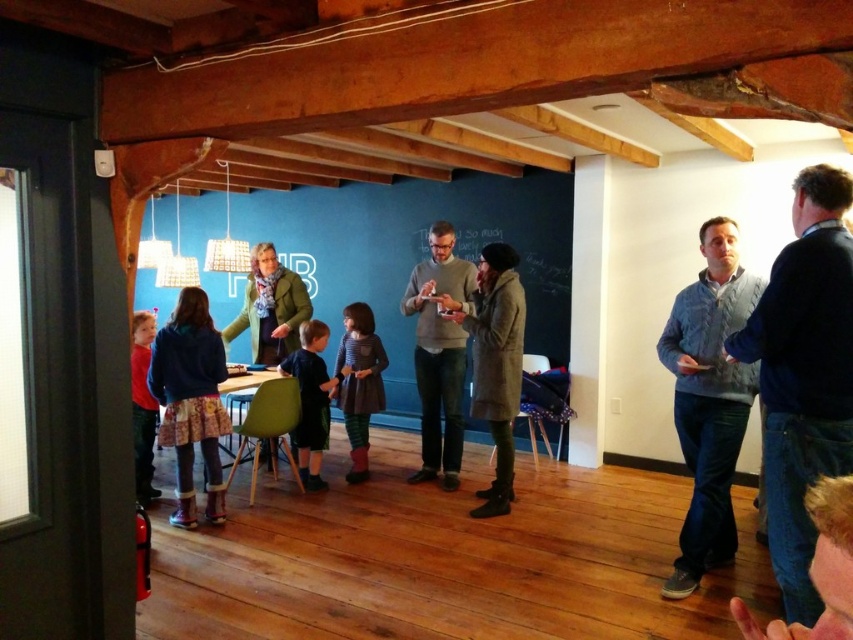
Is dark gray wool coat at center above dark blue shirt at center?

Yes.

Can you confirm if dark gray wool coat at center is smaller than dark blue shirt at center?

Incorrect, dark gray wool coat at center is not smaller in size than dark blue shirt at center.

Between point (486, 262) and point (305, 467), which one is positioned in front?

Point (486, 262) is more forward.

Identify the location of dark gray wool coat at center. (496, 364).

What do you see at coordinates (416, 252) in the screenshot? Image resolution: width=853 pixels, height=640 pixels. I see `matte black chalkboard at center` at bounding box center [416, 252].

Looking at this image, can you confirm if matte black chalkboard at center is bigger than dark blue shirt at center?

Correct, matte black chalkboard at center is larger in size than dark blue shirt at center.

This screenshot has height=640, width=853. What do you see at coordinates (416, 252) in the screenshot? I see `matte black chalkboard at center` at bounding box center [416, 252].

In order to click on matte black chalkboard at center in this screenshot , I will do `click(416, 252)`.

Is dark blue sweater at right behind red matte sweater at left?

No.

Who is more distant from viewer, (x=793, y=326) or (x=136, y=321)?

Point (x=136, y=321)

This screenshot has width=853, height=640. What do you see at coordinates (804, 374) in the screenshot?
I see `dark blue sweater at right` at bounding box center [804, 374].

Where is `dark blue sweater at right`? This screenshot has height=640, width=853. dark blue sweater at right is located at coordinates [804, 374].